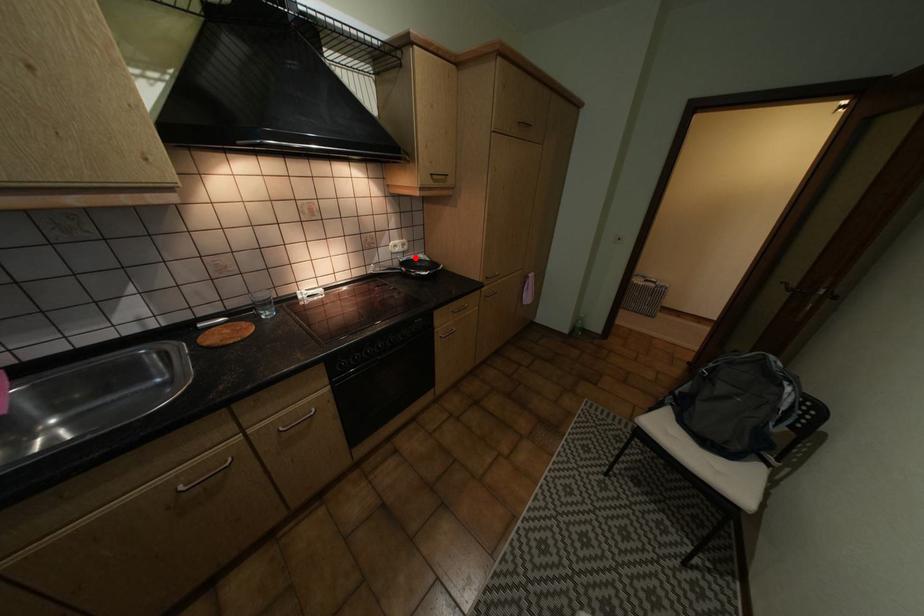
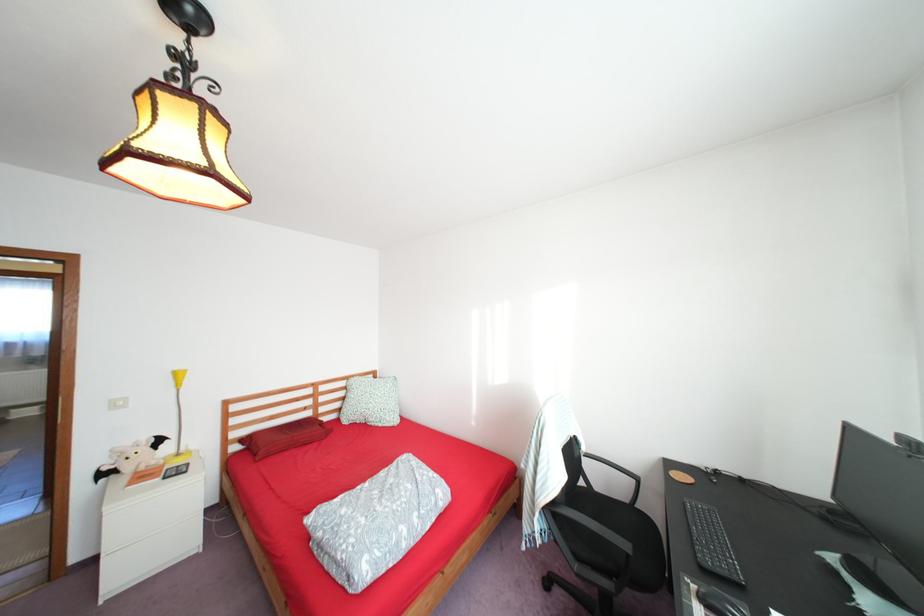
Question: I am providing you with two images of the same scene from different viewpoints. A red point is marked on the first image. Is the red point's position out of view in image 2?

Choices:
 (A) Yes
 (B) No

Answer: (A)